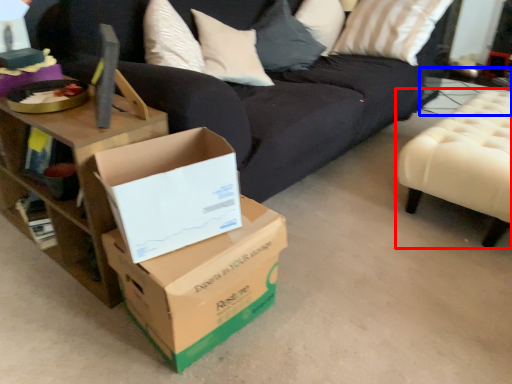
Question: Which object is further to the camera taking this photo, furniture (highlighted by a red box) or side table (highlighted by a blue box)?

Choices:
 (A) furniture
 (B) side table

Answer: (B)